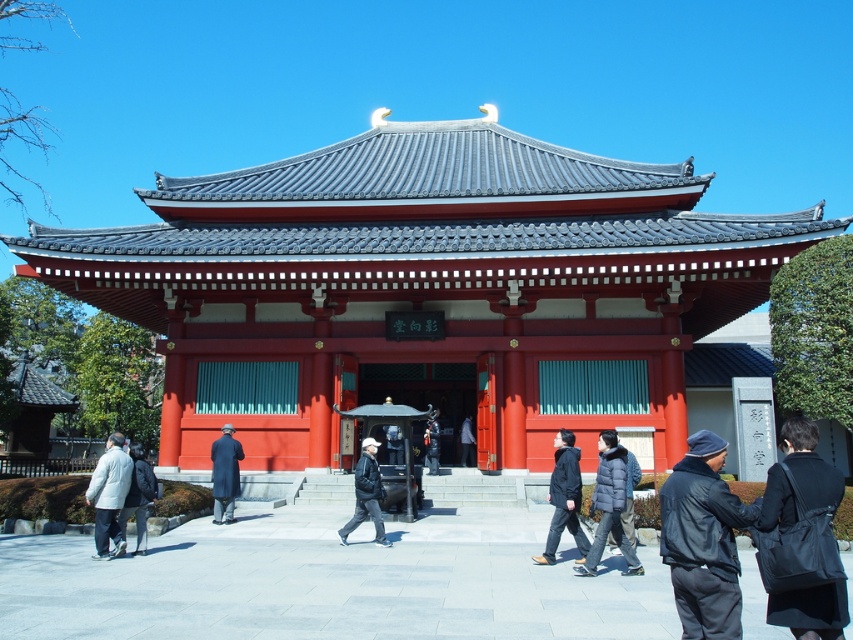
Question: Can you confirm if dark blue down jacket at center is thinner than dark blue jacket at center?

Choices:
 (A) no
 (B) yes

Answer: (A)

Question: Is black leather bag at center further to the viewer compared to dark gray jacket at center?

Choices:
 (A) no
 (B) yes

Answer: (A)

Question: Which of the following is the closest to the observer?

Choices:
 (A) (218, 492)
 (B) (148, 480)
 (C) (428, 445)
 (D) (563, 444)

Answer: (D)

Question: Which of the following is the closest to the observer?

Choices:
 (A) (216, 508)
 (B) (786, 596)

Answer: (B)

Question: Does dark blue down jacket at center appear under dark gray wool coat at center?

Choices:
 (A) no
 (B) yes

Answer: (A)

Question: Which of these objects is positioned closest to the black leather bag at center?

Choices:
 (A) dark gray wool coat at center
 (B) dark gray jacket at center
 (C) dark gray fabric jacket at center
 (D) dark blue jacket at center

Answer: (C)